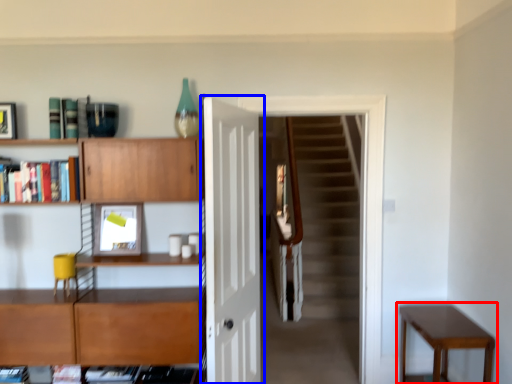
Question: Among these objects, which one is nearest to the camera, table (highlighted by a red box) or door (highlighted by a blue box)?

Choices:
 (A) table
 (B) door

Answer: (B)